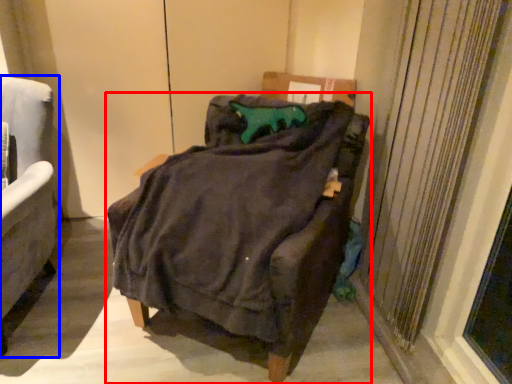
Question: Which point is closer to the camera, chair (highlighted by a red box) or chair (highlighted by a blue box)?

Choices:
 (A) chair
 (B) chair

Answer: (A)